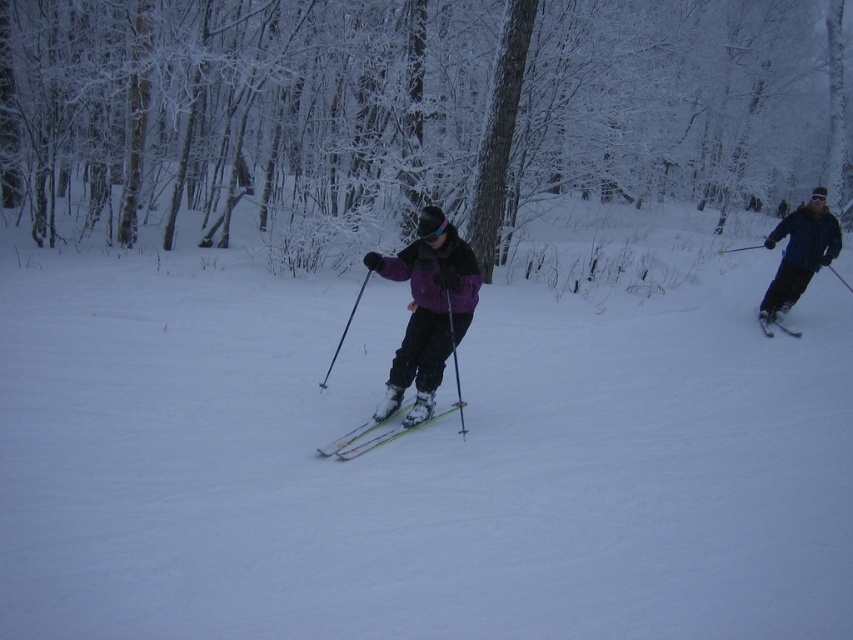
Question: Can you confirm if green glossy skis at center is wider than matte black ski at right?

Choices:
 (A) no
 (B) yes

Answer: (B)

Question: Based on their relative distances, which object is nearer to the matte black ski at right?

Choices:
 (A) purple fleece jacket at center
 (B) snowy bark tree at center
 (C) white snow ski slope at center

Answer: (C)

Question: Among these points, which one is farthest from the camera?

Choices:
 (A) (334, 449)
 (B) (395, 275)
 (C) (762, 317)
 (D) (776, 294)

Answer: (D)

Question: Is snowy bark tree at center positioned behind blue matte jacket at right?

Choices:
 (A) no
 (B) yes

Answer: (B)

Question: Which point appears farthest from the camera in this image?

Choices:
 (A) (769, 332)
 (B) (370, 268)
 (C) (18, 8)
 (D) (428, 419)

Answer: (C)

Question: Does purple fleece jacket at center have a larger size compared to blue matte jacket at right?

Choices:
 (A) no
 (B) yes

Answer: (A)